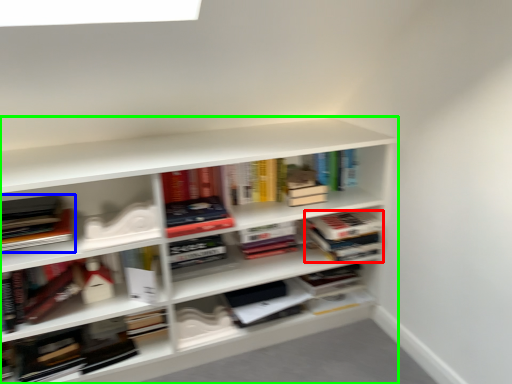
Question: Estimate the real-world distances between objects in this image. Which object is closer to book (highlighted by a red box), book (highlighted by a blue box) or shelf (highlighted by a green box)?

Choices:
 (A) book
 (B) shelf

Answer: (B)